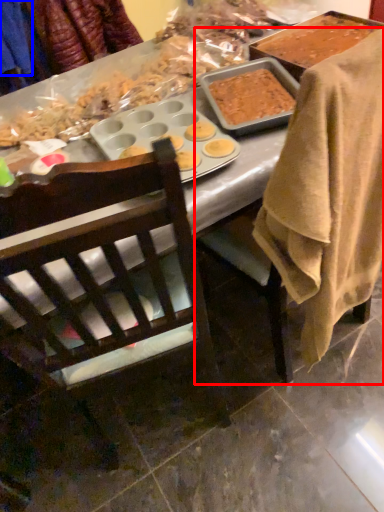
Question: Which object is further to the camera taking this photo, chair (highlighted by a red box) or clothing (highlighted by a blue box)?

Choices:
 (A) chair
 (B) clothing

Answer: (B)